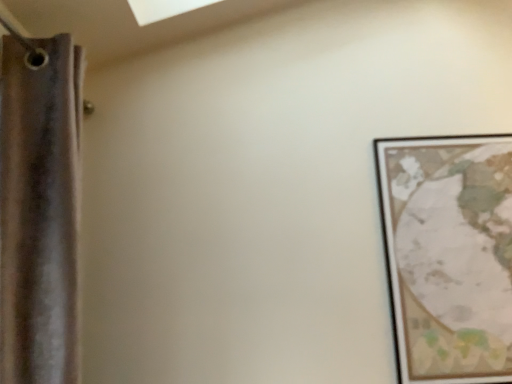
I want to click on brown fabric curtain at left, so click(38, 215).

Describe the element at coordinates (38, 215) in the screenshot. Image resolution: width=512 pixels, height=384 pixels. I see `brown fabric curtain at left` at that location.

At what (x,y) coordinates should I click in order to perform the action: click on wooden framed map at right. Please return your answer as a coordinate pair (x, y). The width and height of the screenshot is (512, 384). Looking at the image, I should click on (449, 255).

The width and height of the screenshot is (512, 384). Describe the element at coordinates (449, 255) in the screenshot. I see `wooden framed map at right` at that location.

Where is `brown fabric curtain at left`? brown fabric curtain at left is located at coordinates pos(38,215).

Considering the positions of objects wooden framed map at right and brown fabric curtain at left in the image provided, who is more to the left, wooden framed map at right or brown fabric curtain at left?

brown fabric curtain at left is more to the left.

Is the depth of wooden framed map at right greater than that of brown fabric curtain at left?

Yes.

Considering the positions of points (398, 286) and (19, 170), is point (398, 286) farther from camera compared to point (19, 170)?

Yes, point (398, 286) is behind point (19, 170).

From the image's perspective, which one is positioned lower, wooden framed map at right or brown fabric curtain at left?

From the image's view, wooden framed map at right is below.

From a real-world perspective, is wooden framed map at right positioned under brown fabric curtain at left based on gravity?

Yes, from a real-world perspective, wooden framed map at right is under brown fabric curtain at left.

Considering the sizes of objects wooden framed map at right and brown fabric curtain at left in the image provided, who is wider, wooden framed map at right or brown fabric curtain at left?

Wider between the two is brown fabric curtain at left.

Considering the sizes of objects wooden framed map at right and brown fabric curtain at left in the image provided, who is taller, wooden framed map at right or brown fabric curtain at left?

With more height is brown fabric curtain at left.

Who is bigger, wooden framed map at right or brown fabric curtain at left?

With larger size is brown fabric curtain at left.

Do you think wooden framed map at right is within brown fabric curtain at left, or outside of it?

wooden framed map at right exists outside the volume of brown fabric curtain at left.

Would you consider wooden framed map at right to be distant from brown fabric curtain at left?

Indeed, wooden framed map at right is not near brown fabric curtain at left.

Is wooden framed map at right aimed at brown fabric curtain at left?

No.

What's the angular difference between wooden framed map at right and brown fabric curtain at left's facing directions?

89.7 degrees separate the facing orientations of wooden framed map at right and brown fabric curtain at left.

How distant is wooden framed map at right from brown fabric curtain at left?

wooden framed map at right is 1.04 meters away from brown fabric curtain at left.

Identify the location of picture frame behind the brown fabric curtain at left. (449, 255).

Looking at this image, between brown fabric curtain at left and wooden framed map at right, which one appears on the right side from the viewer's perspective?

wooden framed map at right is more to the right.

Does brown fabric curtain at left come in front of wooden framed map at right?

Yes, the depth of brown fabric curtain at left is less than that of wooden framed map at right.

Which is behind, point (20, 190) or point (489, 357)?

Point (489, 357)

From the image's perspective, is brown fabric curtain at left on wooden framed map at right?

Yes, from the image's perspective, brown fabric curtain at left is over wooden framed map at right.

From a real-world perspective, is brown fabric curtain at left located beneath wooden framed map at right?

Result: Actually, brown fabric curtain at left is physically above wooden framed map at right in the real world.

In terms of width, does brown fabric curtain at left look wider or thinner when compared to wooden framed map at right?

Considering their sizes, brown fabric curtain at left looks broader than wooden framed map at right.

Which of these two, brown fabric curtain at left or wooden framed map at right, stands taller?

brown fabric curtain at left is taller.

Consider the image. Is brown fabric curtain at left smaller than wooden framed map at right?

Actually, brown fabric curtain at left might be larger than wooden framed map at right.

Is brown fabric curtain at left outside of wooden framed map at right?

Indeed, brown fabric curtain at left is completely outside wooden framed map at right.

Is brown fabric curtain at left beside wooden framed map at right?

They are not placed beside each other.

Could you tell me if brown fabric curtain at left is turned towards wooden framed map at right?

Yes.

Can you tell me how much brown fabric curtain at left and wooden framed map at right differ in facing direction?

They differ by 89.7 degrees in their facing directions.

In order to click on curtain in front of the wooden framed map at right in this screenshot , I will do `click(38, 215)`.

I want to click on picture frame below the brown fabric curtain at left (from the image's perspective), so click(x=449, y=255).

Where is `curtain on the left of wooden framed map at right`? curtain on the left of wooden framed map at right is located at coordinates (38, 215).